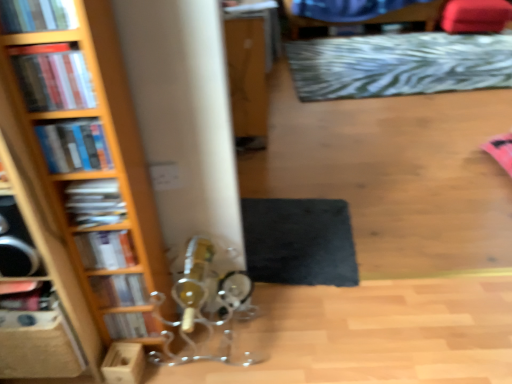
Question: Is blue fabric swivel chair at upper center in front of or behind hardcover book at lower left, which is the 1th book from back to front, in the image?

Choices:
 (A) behind
 (B) front

Answer: (A)

Question: Looking at their shapes, would you say blue fabric swivel chair at upper center is wider or thinner than hardcover book at lower left, which appears as the 7th book when viewed from the top?

Choices:
 (A) wide
 (B) thin

Answer: (A)

Question: Estimate the real-world distances between objects in this image. Which object is farther from the hardcover book at left, which ranks as the third book in back-to-front order?

Choices:
 (A) wooden box at lower left
 (B) wooden bookcase at left
 (C) hardcover book at left, acting as the 6th book starting from the top
 (D) matte plastic books at left, which appears as the 2th book when viewed from the top
 (E) blue fabric swivel chair at upper center

Answer: (E)

Question: Which of these objects is positioned closest to the hardcover books at left, positioned as the 5th book in back-to-front order?

Choices:
 (A) black felt mat at lower center, which is the 2th mat from back to front
 (B) hardcover book at upper left, which is the 7th book in bottom-to-top order
 (C) wooden box at lower left
 (D) velvet red bean bag chair at upper right
 (E) hardcover book at left, acting as the 6th book starting from the top

Answer: (B)